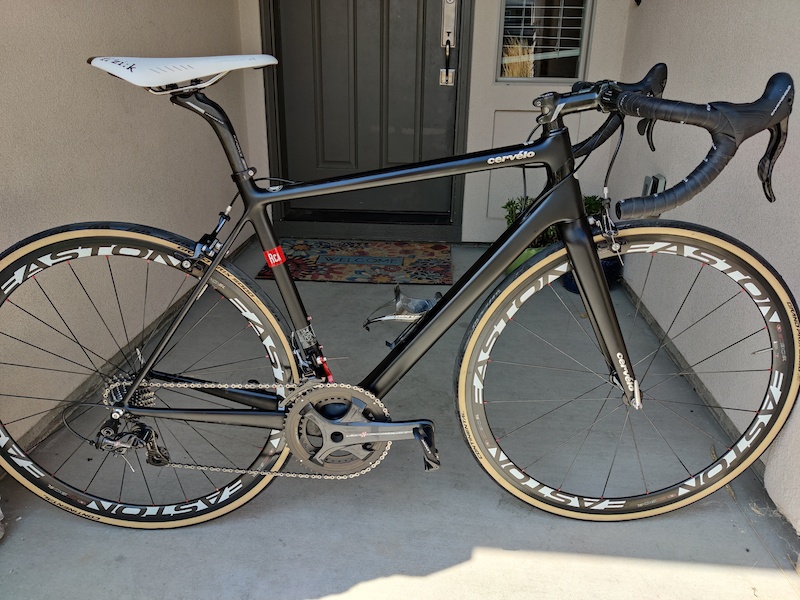
Where is `welcome mat`? This screenshot has height=600, width=800. welcome mat is located at coordinates (332, 254).